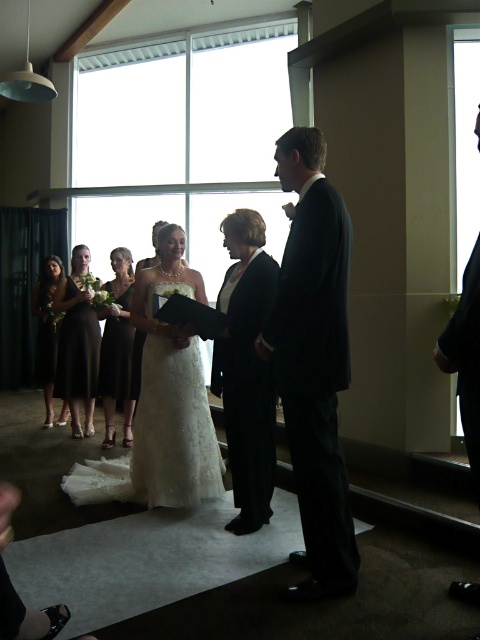
Is point (158, 476) more distant than point (84, 298)?

No, (158, 476) is closer to viewer.

Is white satin dress at center to the right of dark brown satin dress at left from the viewer's perspective?

Correct, you'll find white satin dress at center to the right of dark brown satin dress at left.

Which is in front, point (160, 388) or point (98, 353)?

Point (160, 388) is more forward.

The height and width of the screenshot is (640, 480). Identify the location of white satin dress at center. (166, 400).

Can you confirm if dark brown satin dress at left is shorter than dark brown satin dress at center?

In fact, dark brown satin dress at left may be taller than dark brown satin dress at center.

Which is more to the left, dark brown satin dress at left or dark brown satin dress at center?

Positioned to the left is dark brown satin dress at left.

Who is more forward, [64,385] or [108,420]?

Positioned in front is point [108,420].

The image size is (480, 640). What are the coordinates of `dark brown satin dress at left` in the screenshot? It's located at [76, 344].

Can you confirm if black suit at right is wider than dark brown satin dress at center?

No, black suit at right is not wider than dark brown satin dress at center.

Looking at this image, between black suit at right and dark brown satin dress at center, which one has more height?

dark brown satin dress at center is taller.

Where is `black suit at right`? This screenshot has width=480, height=640. black suit at right is located at coordinates (466, 358).